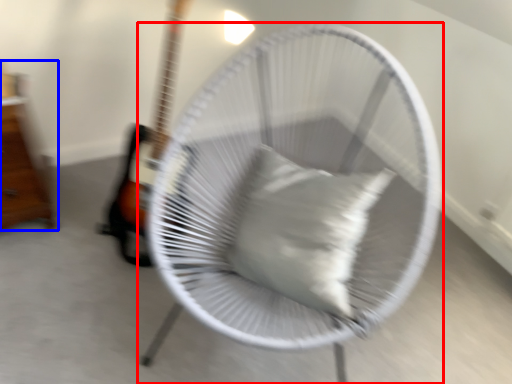
Question: Which object appears closest to the camera in this image, mechanical fan (highlighted by a red box) or furniture (highlighted by a blue box)?

Choices:
 (A) mechanical fan
 (B) furniture

Answer: (A)